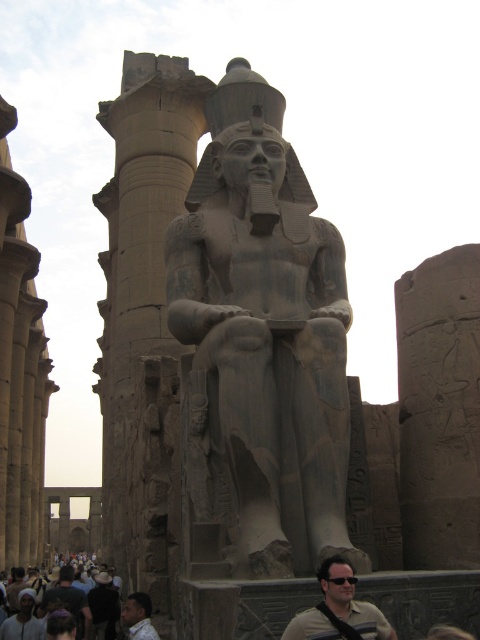
Is point (278, 275) farther from viewer compared to point (336, 580)?

Yes, it is.

Is gray stone statue at center further to the viewer compared to black plastic goggles at center?

Yes, gray stone statue at center is behind black plastic goggles at center.

Find the location of a particular element. The height and width of the screenshot is (640, 480). gray stone statue at center is located at coordinates (260, 349).

Identify the location of gray stone statue at center. (260, 349).

Is tan fabric shirt at center wider than dark brown fabric crowd at lower center?

In fact, tan fabric shirt at center might be narrower than dark brown fabric crowd at lower center.

Measure the distance from tan fabric shirt at center to dark brown fabric crowd at lower center.

The distance of tan fabric shirt at center from dark brown fabric crowd at lower center is 17.21 meters.

Between point (321, 630) and point (60, 588), which one is positioned in front?

Point (321, 630) is in front.

I want to click on tan fabric shirt at center, so pyautogui.click(x=338, y=611).

Between gray stone statue at center and dark brown leather jacket at lower left, which one has more height?

Standing taller between the two is gray stone statue at center.

What do you see at coordinates (260, 349) in the screenshot? I see `gray stone statue at center` at bounding box center [260, 349].

This screenshot has width=480, height=640. What are the coordinates of `gray stone statue at center` in the screenshot? It's located at (260, 349).